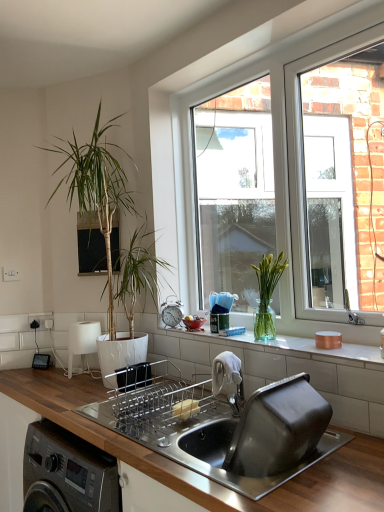
Question: From the image's perspective, is silver metallic alarm clock at upper center, which is counted as the 2th appliance, starting from the bottom, positioned above or below clear glass window at center?

Choices:
 (A) below
 (B) above

Answer: (A)

Question: Is point (167, 298) positioned closer to the camera than point (271, 110)?

Choices:
 (A) farther
 (B) closer

Answer: (A)

Question: Estimate the real-world distances between objects in this image. Which object is closer to the white matte tap at center?

Choices:
 (A) stainless steel sink at center
 (B) clear glass vase at center
 (C) silver metallic alarm clock at upper center, the first appliance viewed from the top
 (D) green leafy plant at left, the 2th houseplant in the right-to-left sequence
 (E) wooden countertop at lower center

Answer: (A)

Question: Which is nearer to the silver metallic alarm clock at upper center, which is the second appliance from left to right?

Choices:
 (A) white matte lamp at left, acting as the 2th appliance starting from the front
 (B) wooden countertop at lower center
 (C) white matte tap at center
 (D) green glass vase at window, which ranks as the 1th houseplant in right-to-left order
 (E) clear glass vase at center

Answer: (E)